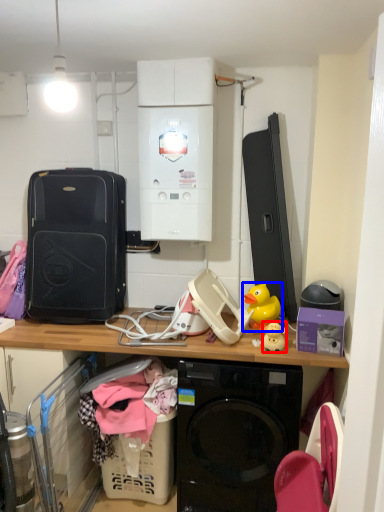
Question: Which of the following is the farthest to the observer, toy (highlighted by a red box) or toy (highlighted by a blue box)?

Choices:
 (A) toy
 (B) toy

Answer: (B)